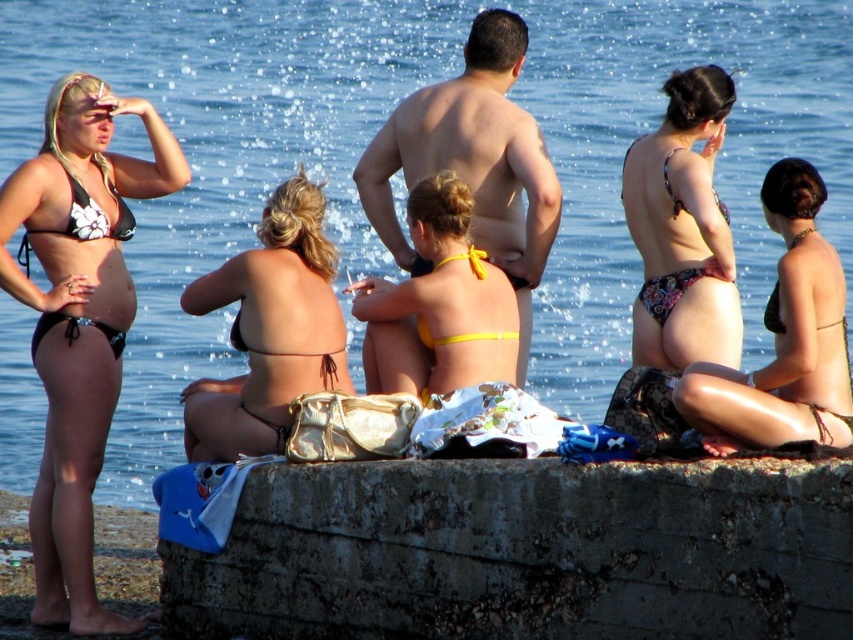
Question: Which object is farther from the camera taking this photo?

Choices:
 (A) floral-patterned bikini bottom at right
 (B) matte black bikini at left

Answer: (A)

Question: Which point is closer to the camera taking this photo?

Choices:
 (A) (334, 381)
 (B) (836, 272)
 (C) (90, 211)
 (D) (480, 616)

Answer: (D)

Question: From the image, what is the correct spatial relationship of rusty concrete wall at lower center in relation to black textured bikini at right?

Choices:
 (A) left
 (B) right

Answer: (A)

Question: Is matte black skin at center behind yellow fabric bikini at center?

Choices:
 (A) yes
 (B) no

Answer: (B)

Question: Which point is closer to the camera?

Choices:
 (A) (300, 513)
 (B) (445, 99)

Answer: (A)

Question: Can you confirm if matte black bikini at left is bigger than black textured bikini at right?

Choices:
 (A) yes
 (B) no

Answer: (A)